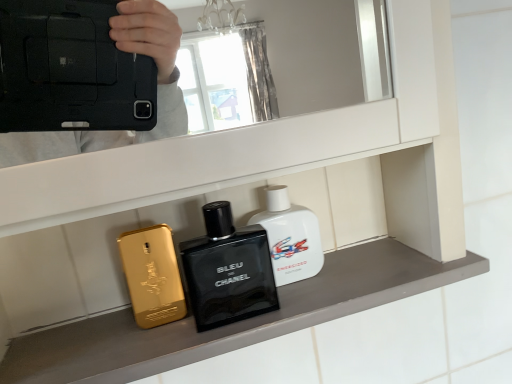
This screenshot has height=384, width=512. I want to click on vacant area that is in front of gold metallic phone at left, the second perfume when ordered from right to left, so click(x=126, y=348).